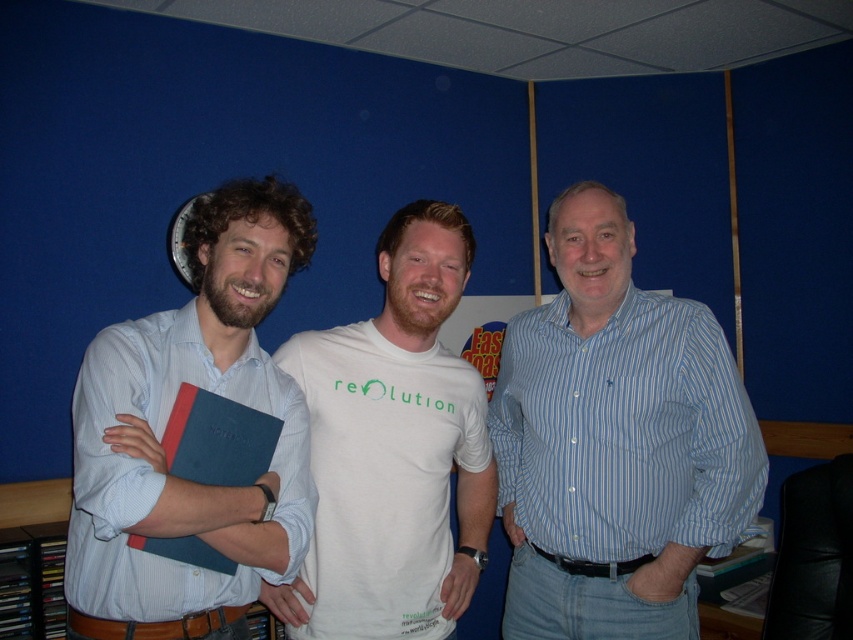
You are standing in front of a group photo of three people. You notice a specific point at coordinates (614, 442). Which person in the photo is closest to this point?

The point at coordinates (614, 442) corresponds to the blue striped shirt at center, so the person wearing the blue striped shirt at center is closest to this point.

In the scene shown: You are a photographer who needs to adjust the lighting to ensure both the blue striped shirt at center and the matte blue book at center are well lit. Given their sizes, which object should you focus more light on to ensure proper exposure?

The blue striped shirt at center has a larger size compared to the matte blue book at center, so you should focus more light on the blue striped shirt at center to ensure proper exposure.